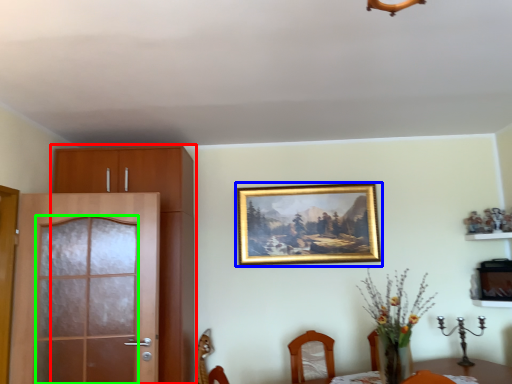
Question: Based on their relative distances, which object is farther from cabinetry (highlighted by a red box)? Choose from picture frame (highlighted by a blue box) and screen door (highlighted by a green box).

Choices:
 (A) picture frame
 (B) screen door

Answer: (A)